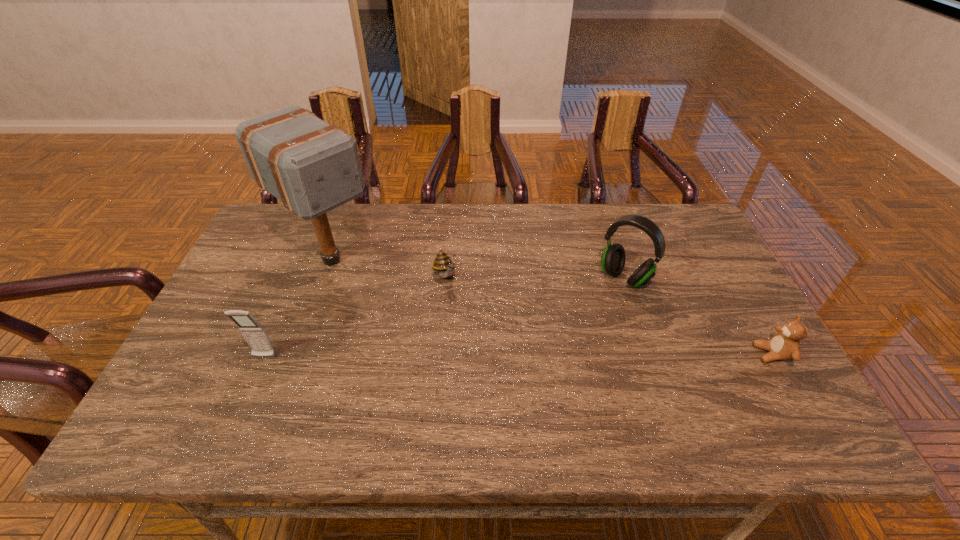
Where is `free spot on the desktop that is between the cellular telephone and the teddy bear and is positioned on the striking surface of the mallet`? free spot on the desktop that is between the cellular telephone and the teddy bear and is positioned on the striking surface of the mallet is located at coordinates (447, 356).

I want to click on free space on the desktop that is between the cellular telephone and the rightmost object and is positioned on the ear cups of the headset, so click(559, 355).

Locate an element on the screen. The width and height of the screenshot is (960, 540). free space on the desktop that is between the cellular telephone and the teddy bear and is positioned on the face of the third object from right to left is located at coordinates (492, 356).